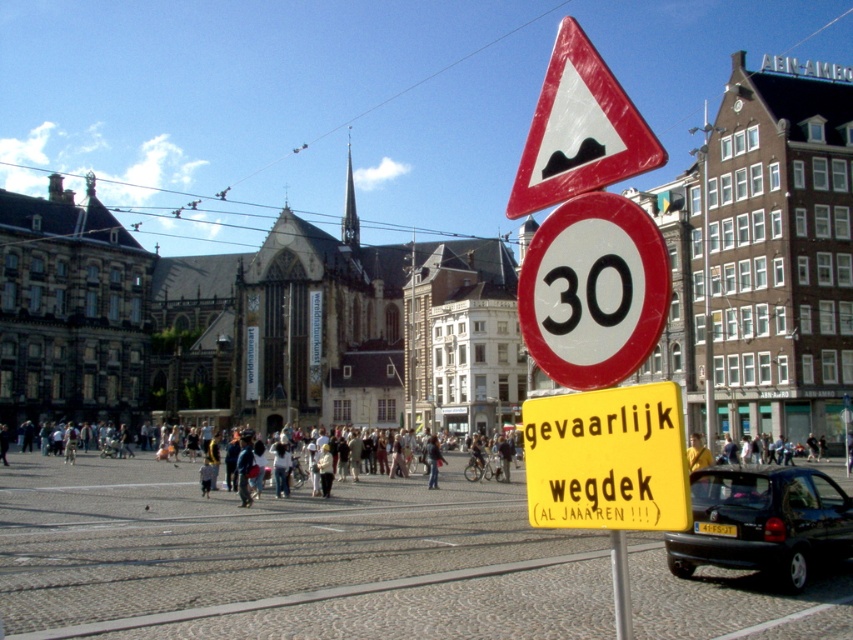
You are a delivery driver approaching the urban square and need to locate the yellow paper sign at center. According to the map, it should be at point [607,460]. Can you confirm if the yellow paper sign at center is indeed at that coordinate?

Yes, the yellow paper sign at center is located at point [607,460] as stated in the map.

You are a delivery driver who needs to deliver a package to a customer. You are currently driving on a road with a speed limit of 30 km per hour. You see a yellow paper sign at center that says

The yellow paper sign at center is 71.29 feet away from the speed limit sign. Since the speed limit is 30 km per hour, you should slow down and proceed with caution as the dangerous road surface is still 71.29 feet ahead.

You are a delivery driver navigating through the urban square. Your GPS indicates a smooth cobblestone plaza at center is located at point (286, 557). Given the traffic signs mentioned in the scene, what should you be cautious about while approaching this plaza?

You should be cautious of the red triangular warning sign with a black silhouette of a speed bump and the circular red and white 30 km speed limit sign near point (286, 557), as well as the yellow rectangular sign warning of a dangerous road surface. These signs indicate potential hazards like speed bumps, a need to reduce speed to 30 km, and a hazardous road condition that requires careful driving.